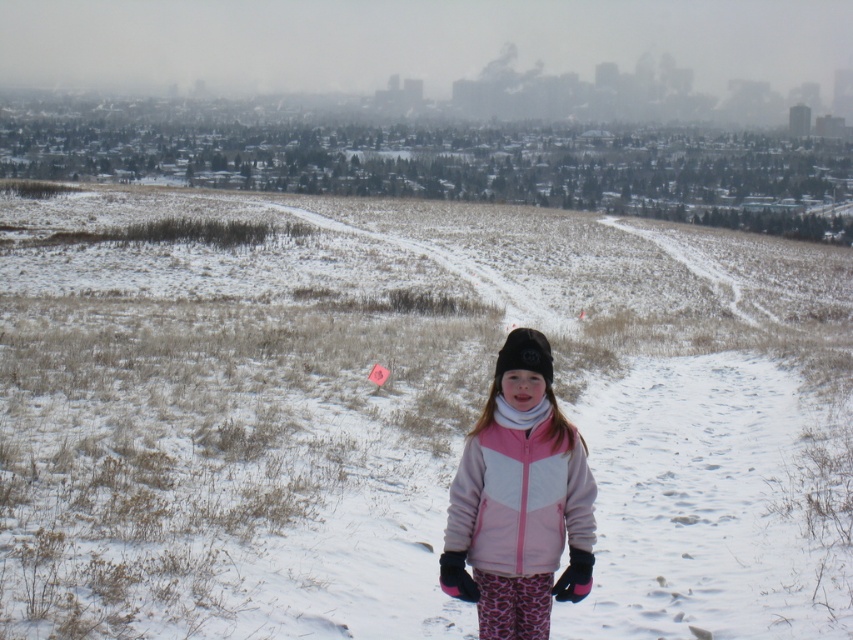
You are a delivery drone trying to land on the white fluffy snow at center located at point (404, 412). The drone requires a landing area of 0.5 meters in diameter. Is the snow at that point sufficient for landing?

The white fluffy snow at center is located at point (404, 412). However, the description does not provide information about the size or suitability of the snow area for landing. Therefore, it is uncertain if the snow at that point is sufficient for landing.

The young girl is standing on the white fluffy snow at center and wearing the pink fleece jacket at center. Which one has a greater width?

The white fluffy snow at center has a greater width than the pink fleece jacket at center.